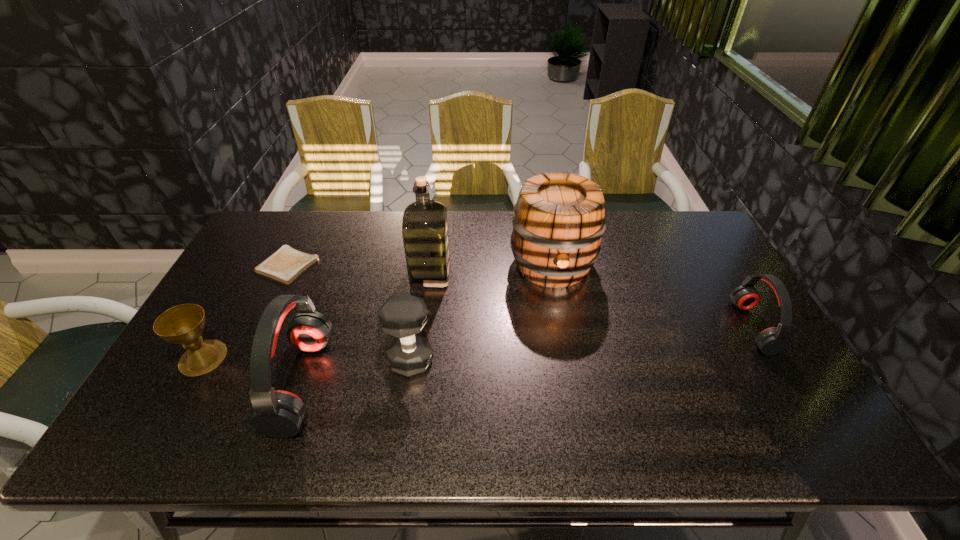
The height and width of the screenshot is (540, 960). What are the coordinates of `the left earphone` in the screenshot? It's located at (278, 414).

You are a GUI agent. You are given a task and a screenshot of the screen. Output one action in this format:
    pyautogui.click(x=<x>, y=<y>)
    Task: Click on the fifth object from right to left
    The height and width of the screenshot is (540, 960).
    Given the screenshot: What is the action you would take?
    pyautogui.click(x=278, y=414)

The width and height of the screenshot is (960, 540). I want to click on the shorter earphone, so click(771, 341).

You are a GUI agent. You are given a task and a screenshot of the screen. Output one action in this format:
    pyautogui.click(x=<x>, y=<y>)
    Task: Click on the right earphone
    Image resolution: width=960 pixels, height=540 pixels.
    Given the screenshot: What is the action you would take?
    pyautogui.click(x=771, y=341)

Locate an element on the screen. The image size is (960, 540). the shortest object is located at coordinates (286, 264).

Locate an element on the screen. This screenshot has height=540, width=960. cider is located at coordinates [x=558, y=220].

You are a GUI agent. You are given a task and a screenshot of the screen. Output one action in this format:
    pyautogui.click(x=<x>, y=<y>)
    Task: Click on the tallest object
    Image resolution: width=960 pixels, height=540 pixels.
    Given the screenshot: What is the action you would take?
    pyautogui.click(x=425, y=226)

This screenshot has height=540, width=960. I want to click on chalice, so tap(183, 324).

Where is `the fourth shortest object`? the fourth shortest object is located at coordinates (403, 316).

The width and height of the screenshot is (960, 540). Identify the location of vacant space located on the ear cups of the left earphone. (425, 382).